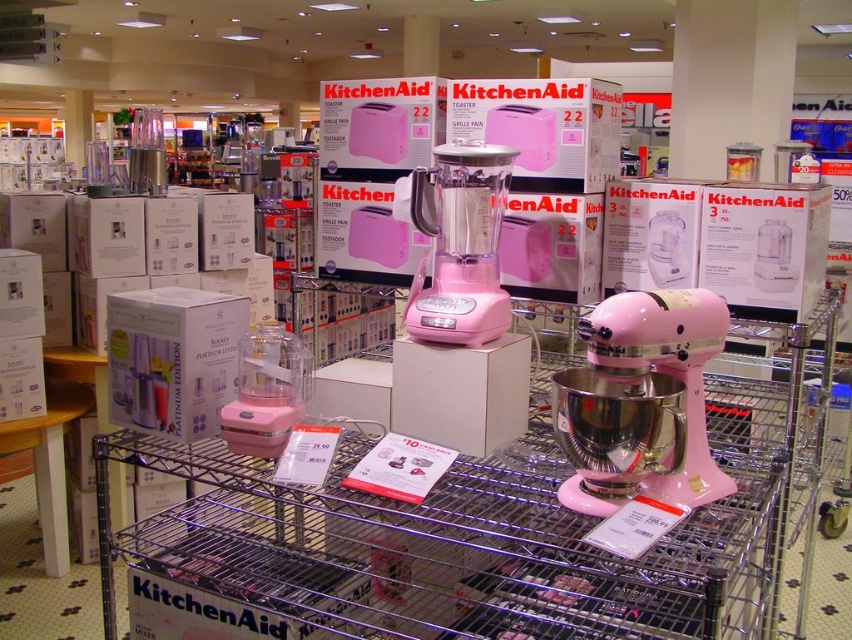
Between pink matte stand mixer at center and pink plastic blender at center, which one appears on the right side from the viewer's perspective?

pink matte stand mixer at center

Measure the distance between pink matte stand mixer at center and pink plastic blender at center.

pink matte stand mixer at center and pink plastic blender at center are 24.93 inches apart.

Does point (642, 364) lie behind point (269, 390)?

That is False.

The image size is (852, 640). I want to click on pink matte stand mixer at center, so click(668, 371).

Which is more to the right, pink matte blender at center or pink plastic blender at center?

From the viewer's perspective, pink matte blender at center appears more on the right side.

Can you confirm if pink matte blender at center is positioned above pink plastic blender at center?

Correct, pink matte blender at center is located above pink plastic blender at center.

Is point (435, 248) farther from camera compared to point (262, 337)?

Yes, point (435, 248) is farther from viewer.

Where is `pink matte blender at center`? pink matte blender at center is located at coordinates (458, 243).

Measure the distance from matte white blender at center to pink matte stand mixer at center.

The distance of matte white blender at center from pink matte stand mixer at center is 31.19 inches.

Between matte white blender at center and pink matte stand mixer at center, which one is positioned lower?

Positioned lower is pink matte stand mixer at center.

Locate an element on the screen. The image size is (852, 640). matte white blender at center is located at coordinates pyautogui.click(x=173, y=358).